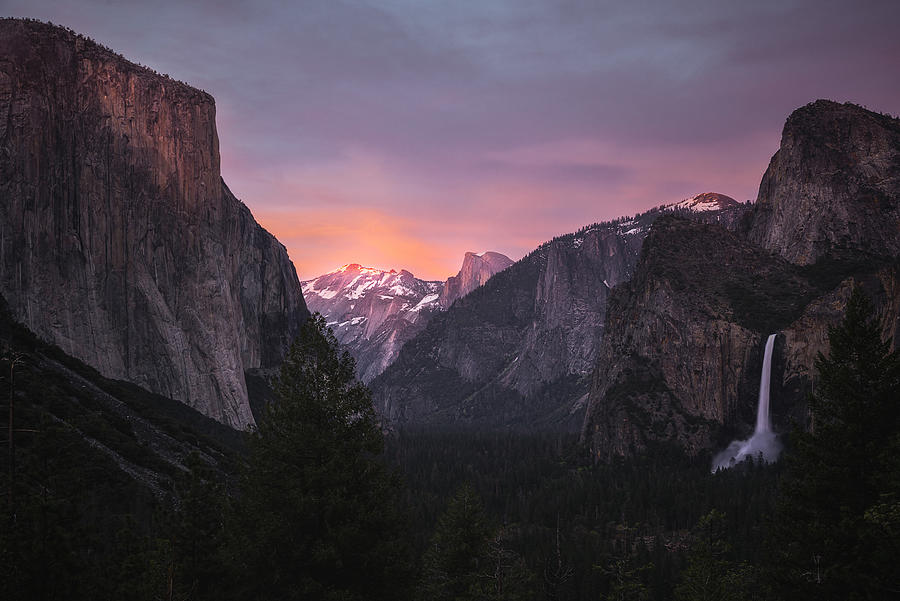
Locate an element on the screen. The width and height of the screenshot is (900, 601). painting is located at coordinates (462, 43).